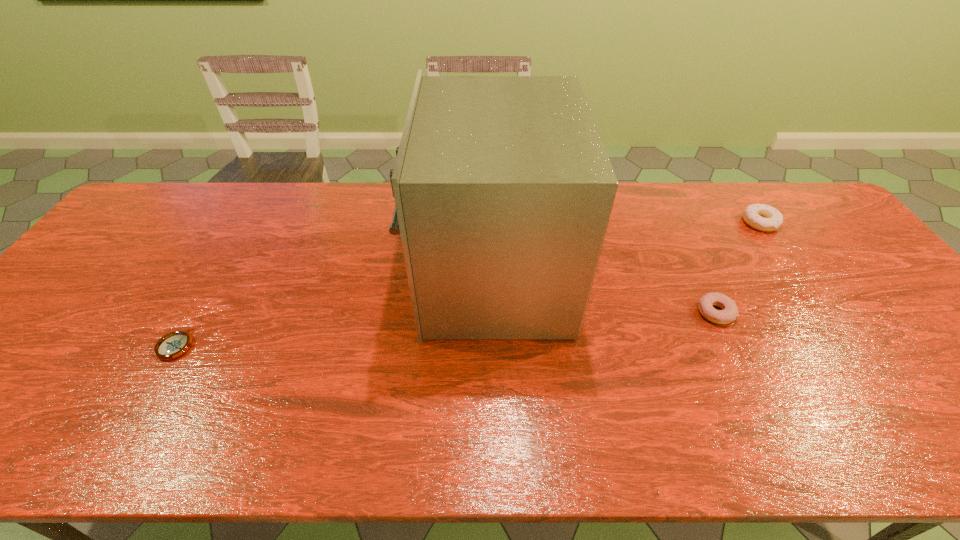
Identify the location of vacant space that satisfies the following two spatial constraints: 1. on the front panel of the tallest object; 2. on the left side of the second object from right to left. (492, 312).

Locate an element on the screen. free space that satisfies the following two spatial constraints: 1. on the back side of the nearer doughnut; 2. on the front panel of the tallest object is located at coordinates point(698,275).

At what (x,y) coordinates should I click in order to perform the action: click on vacant region that satisfies the following two spatial constraints: 1. on the front panel of the toaster oven; 2. on the right side of the shorter doughnut. Please return your answer as a coordinate pair (x, y). The height and width of the screenshot is (540, 960). Looking at the image, I should click on (492, 312).

Where is `vacant region that satisfies the following two spatial constraints: 1. on the front panel of the toaster oven; 2. on the right side of the nearer doughnut`? The height and width of the screenshot is (540, 960). vacant region that satisfies the following two spatial constraints: 1. on the front panel of the toaster oven; 2. on the right side of the nearer doughnut is located at coordinates (492, 312).